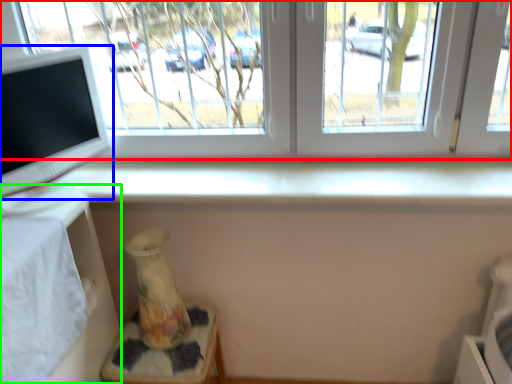
Question: Which object is the closest to the window (highlighted by a red box)? Choose among these: computer monitor (highlighted by a blue box) or table (highlighted by a green box).

Choices:
 (A) computer monitor
 (B) table

Answer: (A)